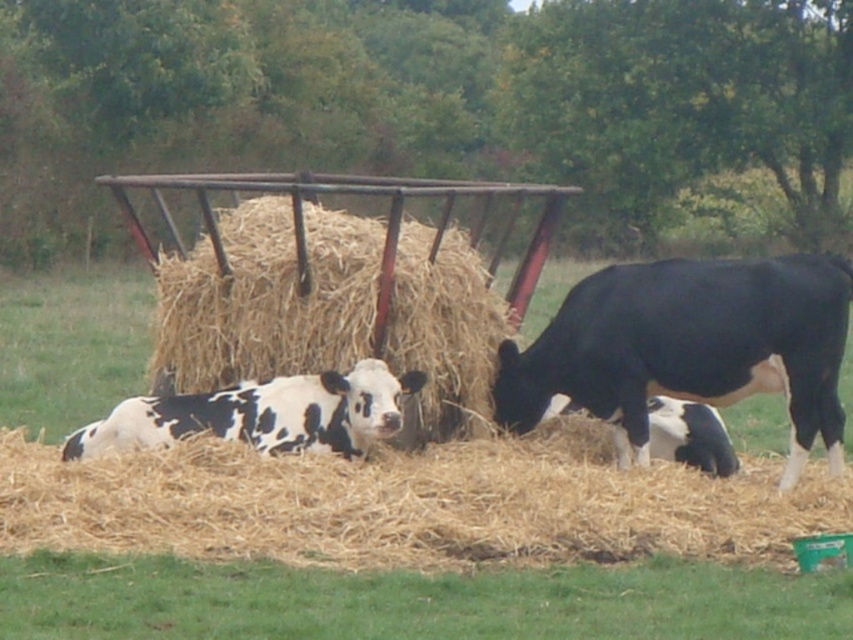
Question: Which object appears farthest from the camera in this image?

Choices:
 (A) light brown straw at center
 (B) black glossy cow at right
 (C) soft green grass at center

Answer: (B)

Question: Estimate the real-world distances between objects in this image. Which object is farther from the soft green grass at center?

Choices:
 (A) wooden hay feeder at center
 (B) black and white spotted calf at center
 (C) black glossy cow at right
 (D) light brown straw at center

Answer: (A)

Question: Considering the relative positions of black glossy cow at right and black and white spotted calf at center in the image provided, where is black glossy cow at right located with respect to black and white spotted calf at center?

Choices:
 (A) left
 (B) right

Answer: (B)

Question: Observing the image, what is the correct spatial positioning of light brown straw at center in reference to soft green grass at center?

Choices:
 (A) left
 (B) right

Answer: (B)

Question: Which point is farther to the camera?

Choices:
 (A) light brown straw at center
 (B) soft green grass at center

Answer: (A)

Question: Does soft green grass at center have a larger size compared to black and white spotted calf at center?

Choices:
 (A) yes
 (B) no

Answer: (A)